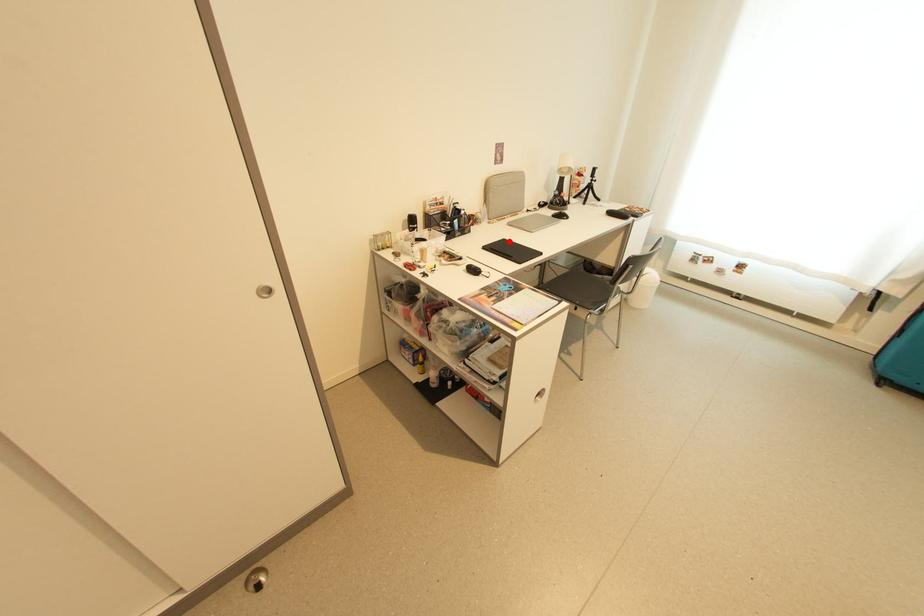
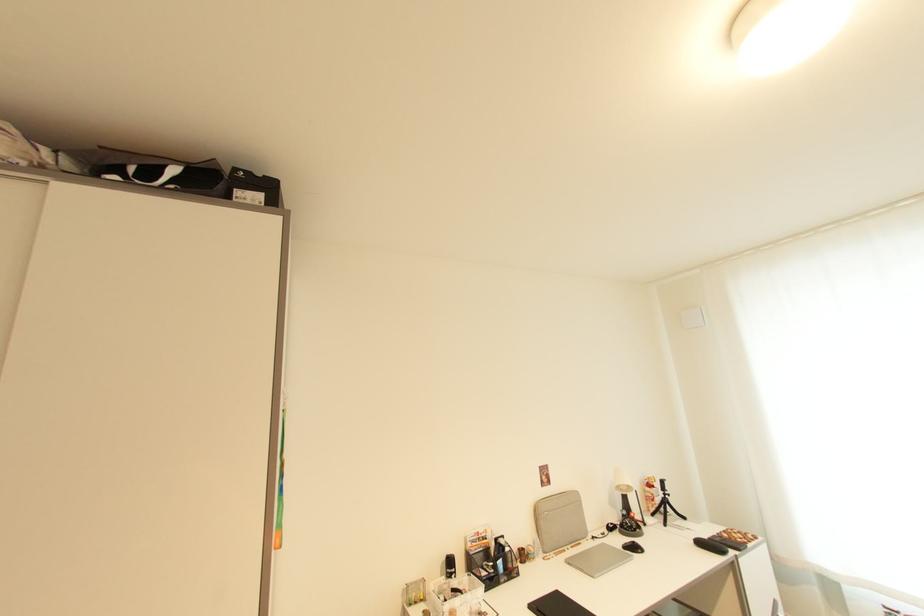
Question: I am providing you with two images of the same scene from different viewpoints. A red point is marked on the first image. Can you still see the location of the red point in image 2?

Choices:
 (A) Yes
 (B) No

Answer: (A)